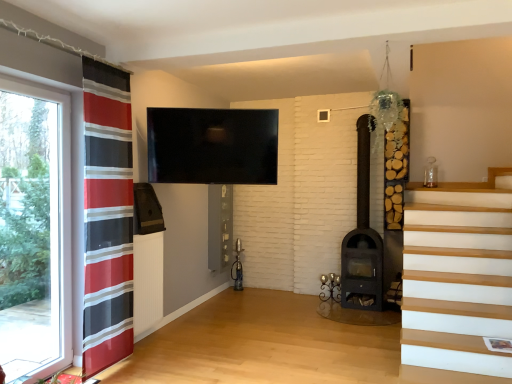
Question: Is transparent glass window at left turned away from dark brown wood-burning stove at center-right?

Choices:
 (A) yes
 (B) no

Answer: (B)

Question: From a real-world perspective, is transparent glass window at left located higher than dark brown wood-burning stove at center-right?

Choices:
 (A) no
 (B) yes

Answer: (A)

Question: Is transparent glass window at left directly adjacent to dark brown wood-burning stove at center-right?

Choices:
 (A) yes
 (B) no

Answer: (B)

Question: Does transparent glass window at left have a smaller size compared to dark brown wood-burning stove at center-right?

Choices:
 (A) yes
 (B) no

Answer: (A)

Question: Is the depth of transparent glass window at left greater than that of dark brown wood-burning stove at center-right?

Choices:
 (A) yes
 (B) no

Answer: (B)

Question: From a real-world perspective, is transparent glass window at left under dark brown wood-burning stove at center-right?

Choices:
 (A) yes
 (B) no

Answer: (A)

Question: Does transparent glass window at left have a greater width compared to red striped curtain at left?

Choices:
 (A) yes
 (B) no

Answer: (A)

Question: Is transparent glass window at left smaller than red striped curtain at left?

Choices:
 (A) yes
 (B) no

Answer: (B)

Question: Is transparent glass window at left not near red striped curtain at left?

Choices:
 (A) yes
 (B) no

Answer: (B)

Question: Is transparent glass window at left to the left of red striped curtain at left from the viewer's perspective?

Choices:
 (A) yes
 (B) no

Answer: (A)

Question: From the image's perspective, would you say transparent glass window at left is positioned over red striped curtain at left?

Choices:
 (A) yes
 (B) no

Answer: (B)

Question: Would you say transparent glass window at left contains red striped curtain at left?

Choices:
 (A) yes
 (B) no

Answer: (B)

Question: Can you confirm if red striped curtain at left is positioned to the left of dark brown wood-burning stove at center-right?

Choices:
 (A) yes
 (B) no

Answer: (A)